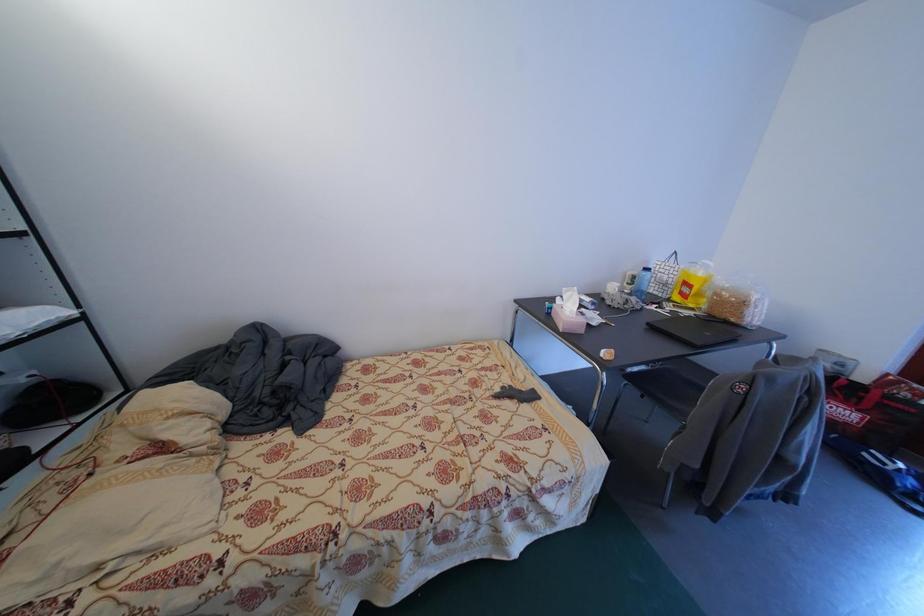
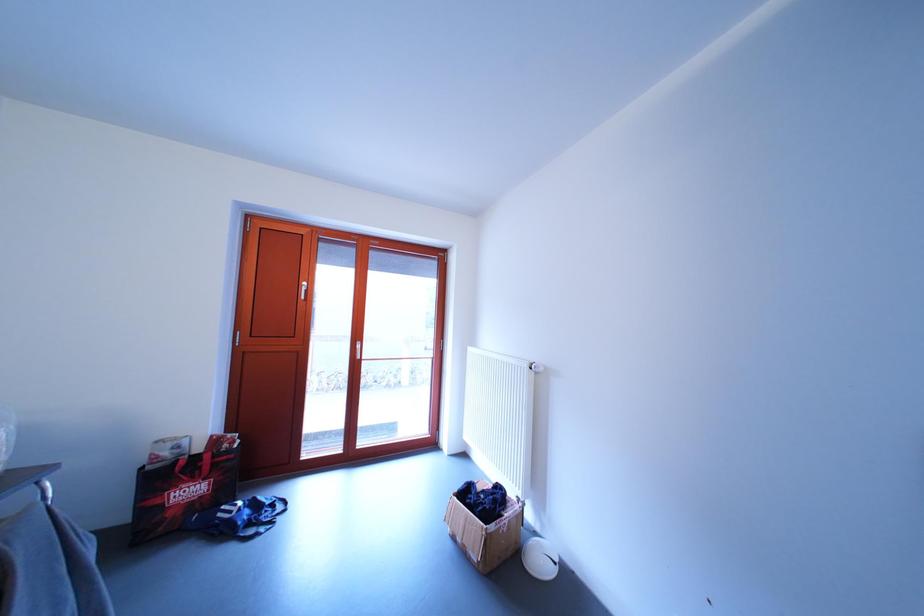
Question: The first image is from the beginning of the video and the second image is from the end. How did the camera likely rotate when shooting the video?

Choices:
 (A) Left
 (B) Right
 (C) Up
 (D) Down

Answer: (B)